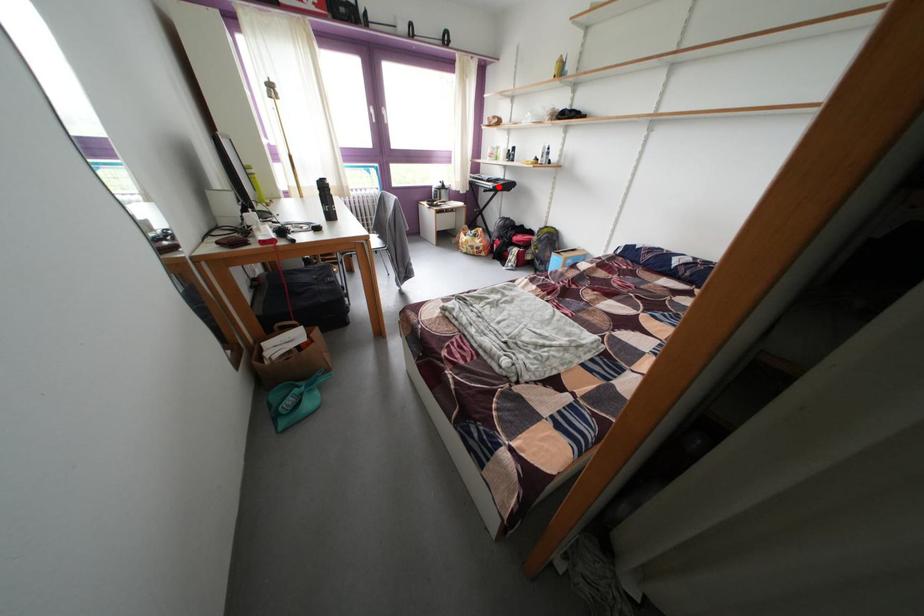
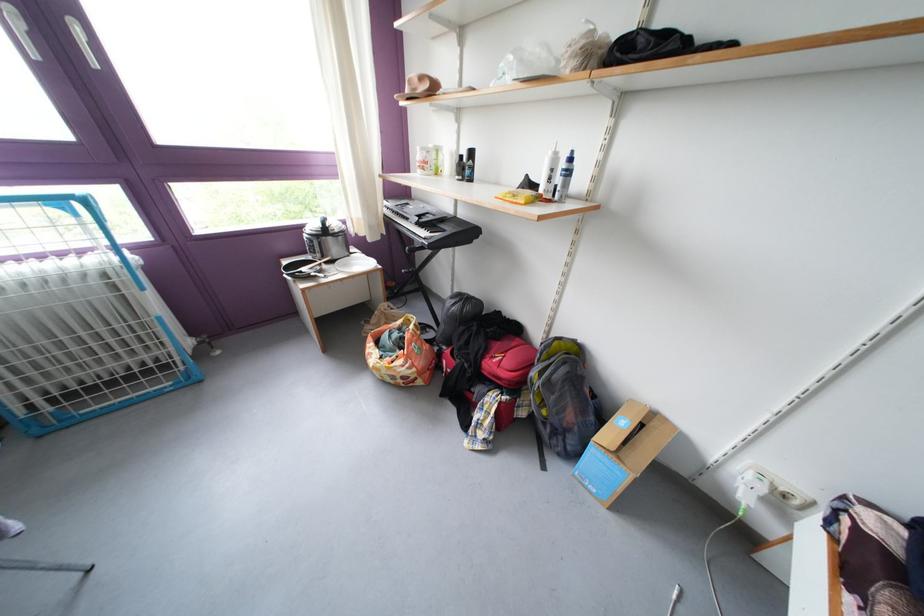
Question: I am providing you with two images of the same scene from different viewpoints. A red point is shown in image1. For the corresponding object point in image2, is it positioned nearer or farther from the camera?

Choices:
 (A) Nearer
 (B) Farther

Answer: (B)